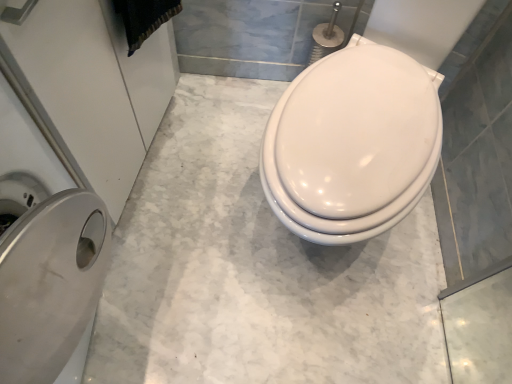
Question: Considering the relative sizes of silver metallic trash can at left and black fabric at upper left in the image provided, is silver metallic trash can at left bigger than black fabric at upper left?

Choices:
 (A) no
 (B) yes

Answer: (B)

Question: From a real-world perspective, does silver metallic trash can at left sit lower than black fabric at upper left?

Choices:
 (A) yes
 (B) no

Answer: (A)

Question: Is silver metallic trash can at left oriented away from black fabric at upper left?

Choices:
 (A) yes
 (B) no

Answer: (B)

Question: Is silver metallic trash can at left placed right next to black fabric at upper left?

Choices:
 (A) yes
 (B) no

Answer: (B)

Question: Can we say silver metallic trash can at left lies outside black fabric at upper left?

Choices:
 (A) yes
 (B) no

Answer: (A)

Question: Considering the positions of silver metallic trash can at left and black fabric at upper left in the image, is silver metallic trash can at left taller or shorter than black fabric at upper left?

Choices:
 (A) short
 (B) tall

Answer: (B)

Question: Considering the relative positions of silver metallic trash can at left and black fabric at upper left in the image provided, is silver metallic trash can at left to the left or to the right of black fabric at upper left?

Choices:
 (A) left
 (B) right

Answer: (A)

Question: Based on their sizes in the image, would you say silver metallic trash can at left is bigger or smaller than black fabric at upper left?

Choices:
 (A) big
 (B) small

Answer: (A)

Question: From a real-world perspective, is silver metallic trash can at left positioned above or below black fabric at upper left?

Choices:
 (A) above
 (B) below

Answer: (B)

Question: Considering the positions of point (354, 175) and point (92, 26), is point (354, 175) closer or farther from the camera than point (92, 26)?

Choices:
 (A) farther
 (B) closer

Answer: (A)

Question: From a real-world perspective, is white glossy toilet at center physically located above or below silver metallic trash can at left?

Choices:
 (A) above
 (B) below

Answer: (A)

Question: Considering the positions of white glossy toilet at center and silver metallic trash can at left in the image, is white glossy toilet at center wider or thinner than silver metallic trash can at left?

Choices:
 (A) thin
 (B) wide

Answer: (B)

Question: In terms of height, does white glossy toilet at center look taller or shorter compared to silver metallic trash can at left?

Choices:
 (A) short
 (B) tall

Answer: (B)

Question: Is black fabric at upper left wider or thinner than white glossy toilet at center?

Choices:
 (A) wide
 (B) thin

Answer: (B)

Question: Considering the positions of black fabric at upper left and white glossy toilet at center in the image, is black fabric at upper left taller or shorter than white glossy toilet at center?

Choices:
 (A) tall
 (B) short

Answer: (B)